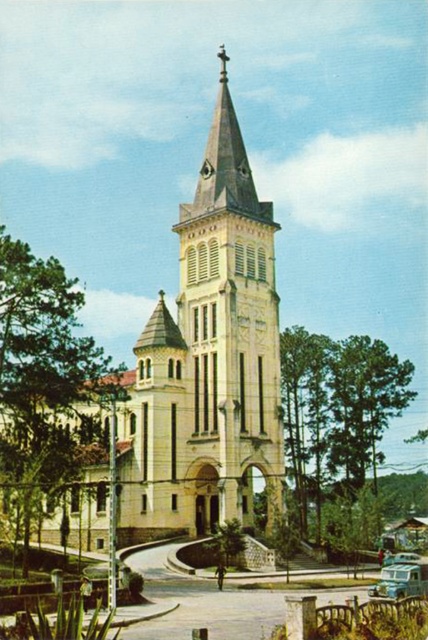
You are standing in front of the church and want to take a photo of the green leafy tree at left. If your camera can focus on objects up to 70 meters away, will it be able to capture the tree clearly?

The green leafy tree at left is 67.77 meters from camera, which is within the camera focus range of up to 70 meters. Therefore, the camera can capture the tree clearly.

You are standing in front of the church and want to take a photo that includes both the green leafy tree at left and the green leafy tree at lower right. Which tree should you move closer to in order to include both in your photo?

To include both the green leafy tree at left and the green leafy tree at lower right in your photo, you should move closer to the green leafy tree at lower right since it is smaller and needs to be framed more prominently.